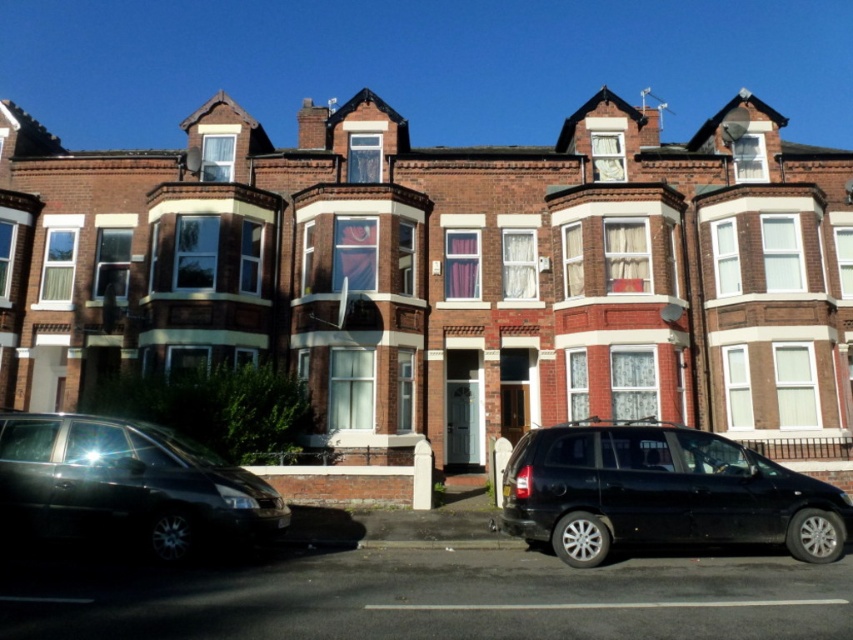
You are standing in front of the row of terraced houses and want to park your car. You see a black matte van at center and a shiny black car at lower left. Which parking spot is closer to the left side of the row of houses?

The shiny black car at lower left is closer to the left side of the row of houses because the black matte van at center is to the right of it.

You are a delivery person who needs to park your vehicle in front of the row of terraced houses. The parking area has a designated spot at coordinates point 0.772, 0.777. Is the black matte van at center currently occupying this spot?

The black matte van at center is located at point (662, 493), so yes, it is occupying the designated parking spot.

You are a delivery person trying to park your shiny black car at lower left in the space between the two black matte van at center and the house. Can your car fit in that space?

The black matte van at center has a larger width than the shiny black car at lower left, so the space between the van and the house may be sufficient for the car to fit, but you should check the exact measurements to be sure.